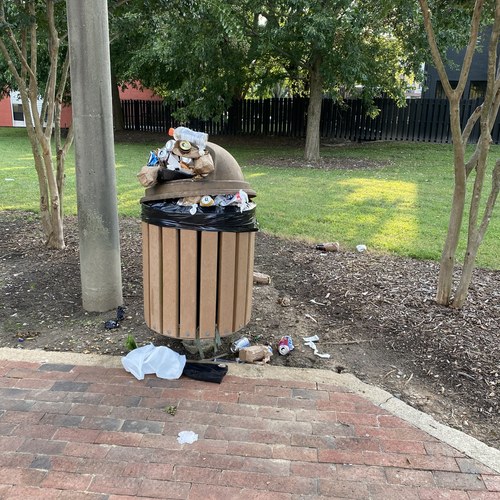
The image size is (500, 500). I want to click on black trash bag, so click(235, 226).